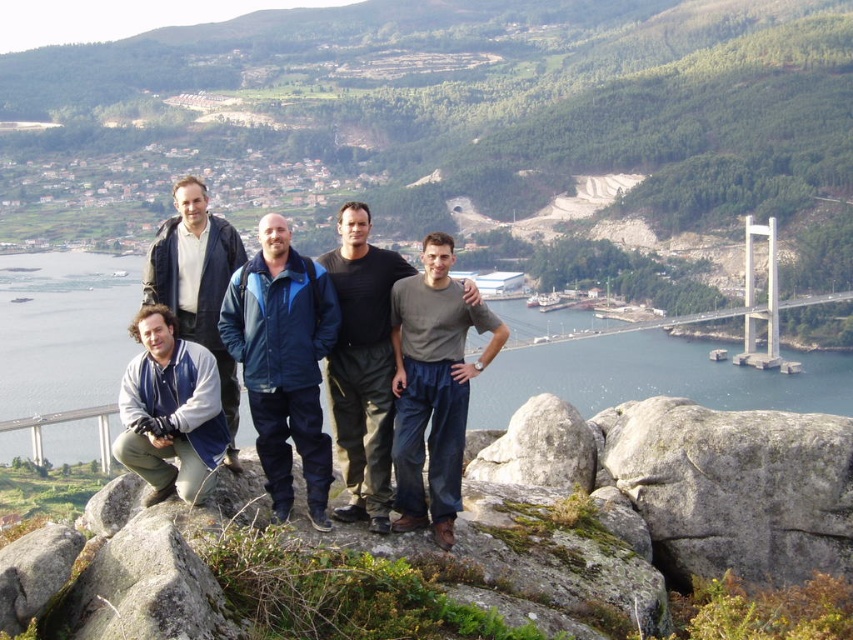
Question: Estimate the real-world distances between objects in this image. Which object is closer to the gray rough rock at center?

Choices:
 (A) blue fabric jacket at center
 (B) matte blue jacket at lower left
 (C) blue water at center

Answer: (A)

Question: Can you confirm if dark gray cotton shirt at center is bigger than matte blue jacket at lower left?

Choices:
 (A) no
 (B) yes

Answer: (B)

Question: Which point is farther to the camera?

Choices:
 (A) blue water at center
 (B) blue fabric jacket at center
 (C) matte gray shirt at center
 (D) dark gray cotton shirt at center

Answer: (A)

Question: Is blue water at center below dark gray cotton shirt at center?

Choices:
 (A) no
 (B) yes

Answer: (B)

Question: Is blue water at center bigger than gray rough rock at center?

Choices:
 (A) yes
 (B) no

Answer: (A)

Question: Which point is closer to the camera?

Choices:
 (A) gray rough rock at center
 (B) blue-gray jacket at lower left

Answer: (B)